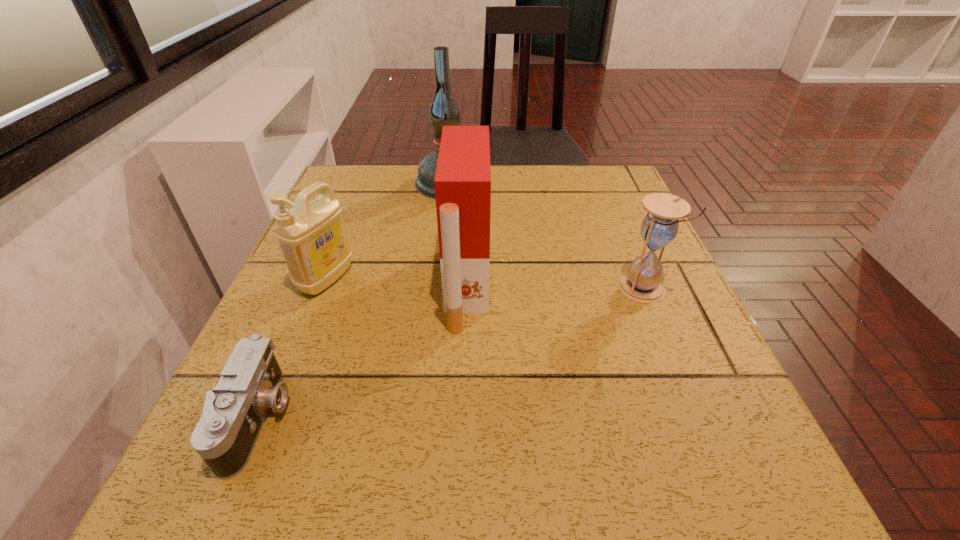
The width and height of the screenshot is (960, 540). Find the location of `vacant space located on the front of the hourglass`. vacant space located on the front of the hourglass is located at coordinates (714, 465).

Where is `vacant area located on the lens of the camera`? Image resolution: width=960 pixels, height=540 pixels. vacant area located on the lens of the camera is located at coordinates (341, 417).

Identify the location of object that is at the far edge. (444, 111).

Identify the location of object located at the near edge. The width and height of the screenshot is (960, 540). (233, 414).

You are a GUI agent. You are given a task and a screenshot of the screen. Output one action in this format:
    pyautogui.click(x=<x>, y=<y>)
    Task: Click on the detergent located in the left edge section of the desktop
    This screenshot has height=540, width=960.
    Given the screenshot: What is the action you would take?
    pyautogui.click(x=312, y=236)

Identify the location of camera that is at the left edge. This screenshot has height=540, width=960. (233, 414).

Locate an element on the screen. The width and height of the screenshot is (960, 540). object positioned at the right edge is located at coordinates [x=642, y=283].

Find the location of `object that is at the near left corner`. object that is at the near left corner is located at coordinates (233, 414).

At what (x,y) coordinates should I click in order to perform the action: click on vacant space at the far edge. Please return your answer as a coordinate pair (x, y). This screenshot has height=540, width=960. Looking at the image, I should click on (511, 187).

Where is `vacant space at the near edge of the desktop`? Image resolution: width=960 pixels, height=540 pixels. vacant space at the near edge of the desktop is located at coordinates (345, 520).